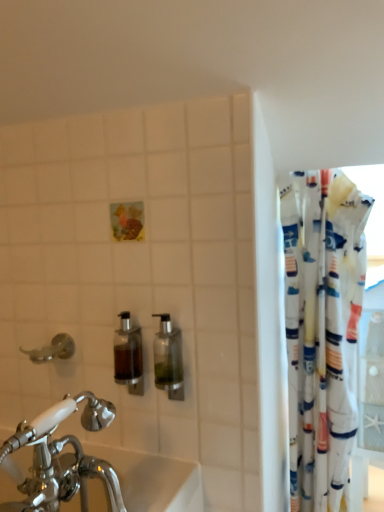
Question: Would you say brushed metal faucet at left is inside or outside clear glass soap dispenser at center, which is the first soap dispenser in right-to-left order?

Choices:
 (A) inside
 (B) outside

Answer: (B)

Question: In terms of height, does brushed metal faucet at left look taller or shorter compared to clear glass soap dispenser at center, which is the first soap dispenser in right-to-left order?

Choices:
 (A) short
 (B) tall

Answer: (A)

Question: Which object is the farthest from the white fabric curtain at right?

Choices:
 (A) clear glass soap dispenser at center, which is the first soap dispenser in right-to-left order
 (B) chrome metallic faucet at lower left
 (C) translucent glass soap dispenser at center, acting as the second soap dispenser starting from the right
 (D) brushed metal faucet at left

Answer: (D)

Question: Which object is positioned closest to the translucent glass soap dispenser at center, acting as the second soap dispenser starting from the right?

Choices:
 (A) clear glass soap dispenser at center, arranged as the second soap dispenser when viewed from the left
 (B) brushed metal faucet at left
 (C) white fabric curtain at right
 (D) chrome metallic faucet at lower left

Answer: (A)